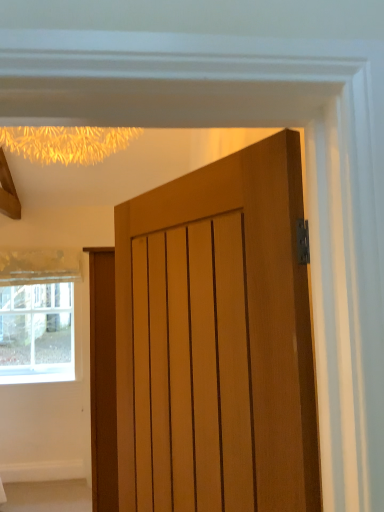
Question: From a real-world perspective, is wooden door at center positioned above or below clear glass window at lower left?

Choices:
 (A) above
 (B) below

Answer: (A)

Question: Is wooden door at center to the left or to the right of clear glass window at lower left in the image?

Choices:
 (A) right
 (B) left

Answer: (A)

Question: Considering the positions of wooden door at center and clear glass window at lower left in the image, is wooden door at center taller or shorter than clear glass window at lower left?

Choices:
 (A) tall
 (B) short

Answer: (A)

Question: Do you think clear glass window at lower left is within wooden door at center, or outside of it?

Choices:
 (A) outside
 (B) inside

Answer: (A)

Question: From a real-world perspective, relative to wooden door at center, is clear glass window at lower left vertically above or below?

Choices:
 (A) above
 (B) below

Answer: (B)

Question: Is point (39, 301) positioned closer to the camera than point (299, 182)?

Choices:
 (A) farther
 (B) closer

Answer: (A)

Question: Based on their positions, is clear glass window at lower left located to the left or right of wooden door at center?

Choices:
 (A) left
 (B) right

Answer: (A)